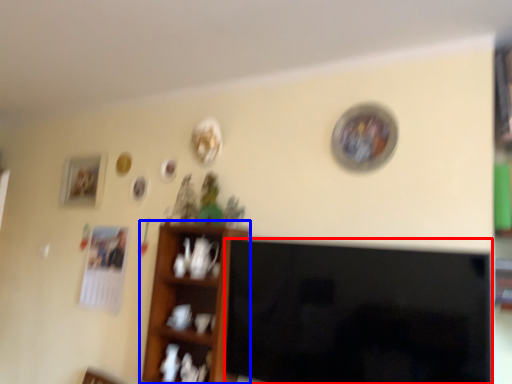
Question: Which object is closer to the camera taking this photo, television (highlighted by a red box) or shelf (highlighted by a blue box)?

Choices:
 (A) television
 (B) shelf

Answer: (A)